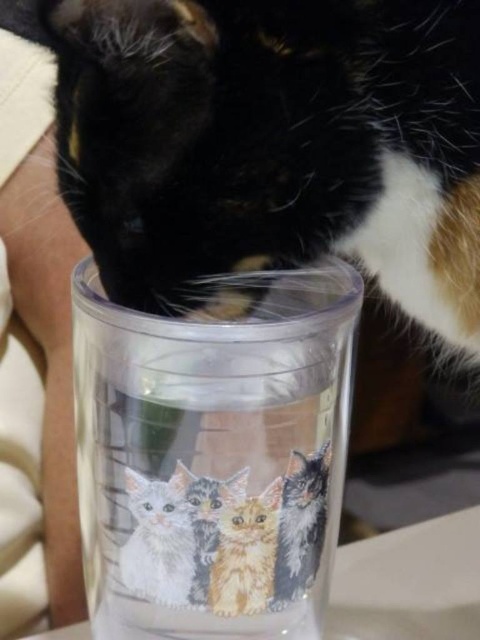
Question: Among these objects, which one is nearest to the camera?

Choices:
 (A) fluffy orange kitten at center
 (B) white fur cat at lower center
 (C) transparent plastic cup at center
 (D) calico fur cat at center

Answer: (D)

Question: Is calico fur cat at center above white fur cat at lower center?

Choices:
 (A) no
 (B) yes

Answer: (B)

Question: Which object is positioned closest to the fluffy orange kitten at center?

Choices:
 (A) transparent plastic cup at center
 (B) white fur cat at lower center
 (C) calico fur cat at center

Answer: (B)

Question: Is calico fur cat at center wider than fluffy orange kitten at center?

Choices:
 (A) no
 (B) yes

Answer: (B)

Question: Which point is farther from the camera taking this photo?

Choices:
 (A) (278, 289)
 (B) (315, 52)
 (C) (131, 534)

Answer: (A)

Question: Does calico fur cat at center have a greater width compared to fluffy orange kitten at center?

Choices:
 (A) no
 (B) yes

Answer: (B)